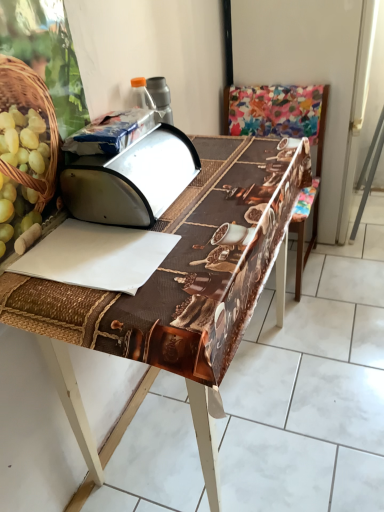
The height and width of the screenshot is (512, 384). I want to click on vacant area on top of brown woven table at center (from a real-world perspective), so click(x=190, y=206).